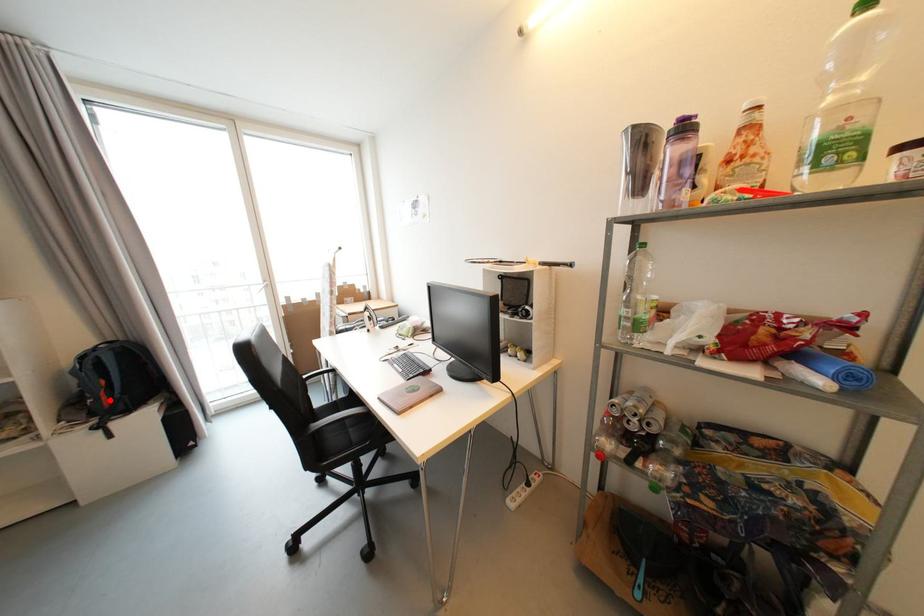
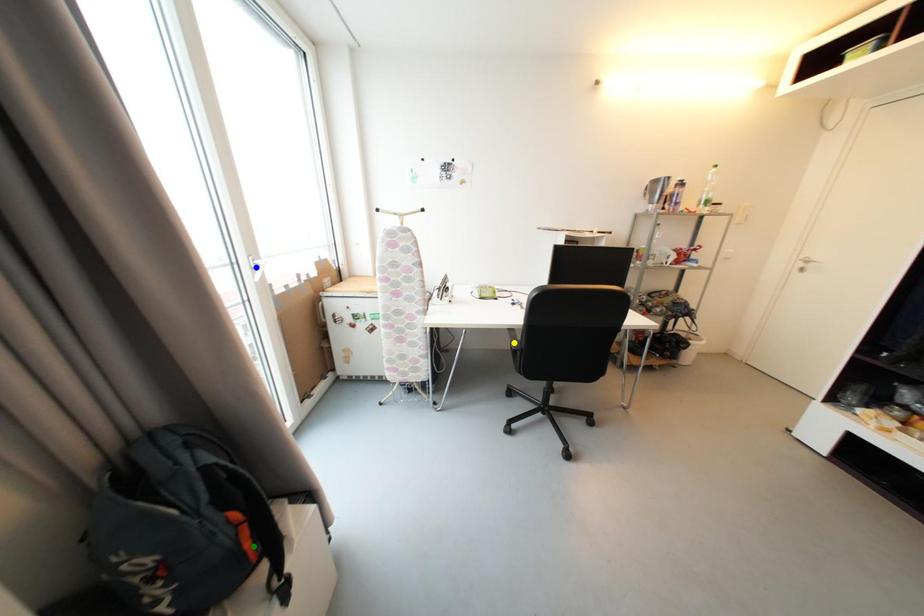
Question: I am providing you with two images of the same scene from different viewpoints. A red point is marked on the first image. You are given multiple points on the second image. Which spot in image 2 lines up with the point in image 1?

Choices:
 (A) green point
 (B) blue point
 (C) yellow point

Answer: (A)